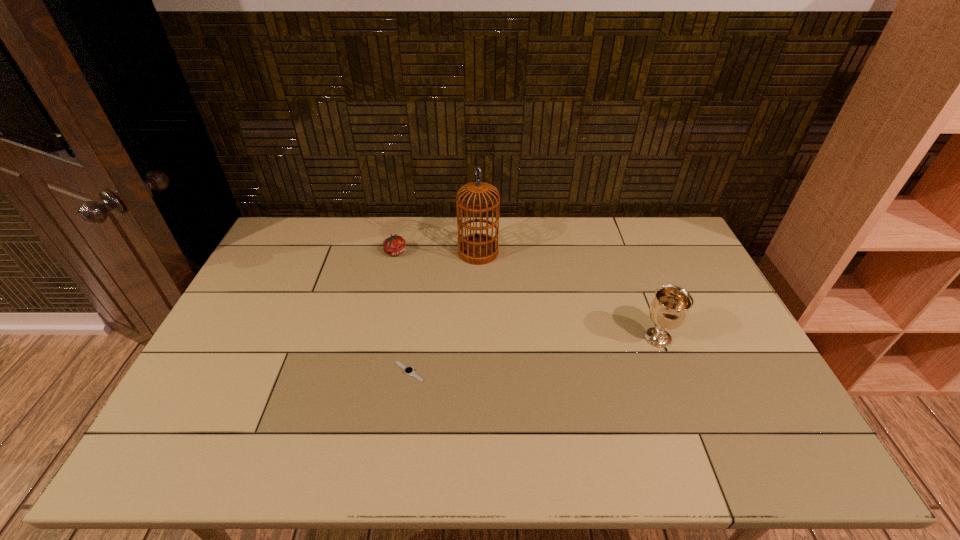
Identify the location of birdcage. The width and height of the screenshot is (960, 540). (477, 249).

Where is `the second object from right to left`? The image size is (960, 540). the second object from right to left is located at coordinates (477, 249).

Locate an element on the screen. Image resolution: width=960 pixels, height=540 pixels. the rightmost object is located at coordinates (669, 310).

Where is `chalice`? This screenshot has height=540, width=960. chalice is located at coordinates (669, 310).

You are a GUI agent. You are given a task and a screenshot of the screen. Output one action in this format:
    pyautogui.click(x=<x>, y=<y>)
    Task: Click on the tomato
    This screenshot has width=960, height=540.
    Given the screenshot: What is the action you would take?
    pyautogui.click(x=395, y=245)

Image resolution: width=960 pixels, height=540 pixels. I want to click on the leftmost object, so click(x=395, y=245).

Locate an element on the screen. watch is located at coordinates (408, 370).

This screenshot has width=960, height=540. In order to click on the shortest object in this screenshot , I will do `click(408, 370)`.

At what (x,y) coordinates should I click in order to perform the action: click on vacant space situated 0.360m on the front of the tallest object. Please return your answer as a coordinate pair (x, y). The width and height of the screenshot is (960, 540). Looking at the image, I should click on (478, 349).

Find the location of `vacant area situated 0.160m on the left of the rightmost object`. vacant area situated 0.160m on the left of the rightmost object is located at coordinates (585, 338).